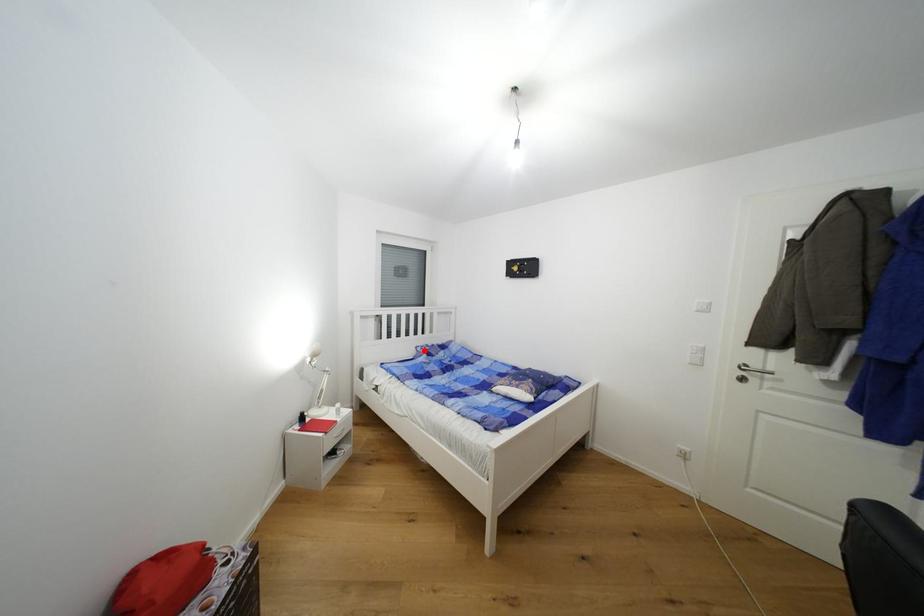
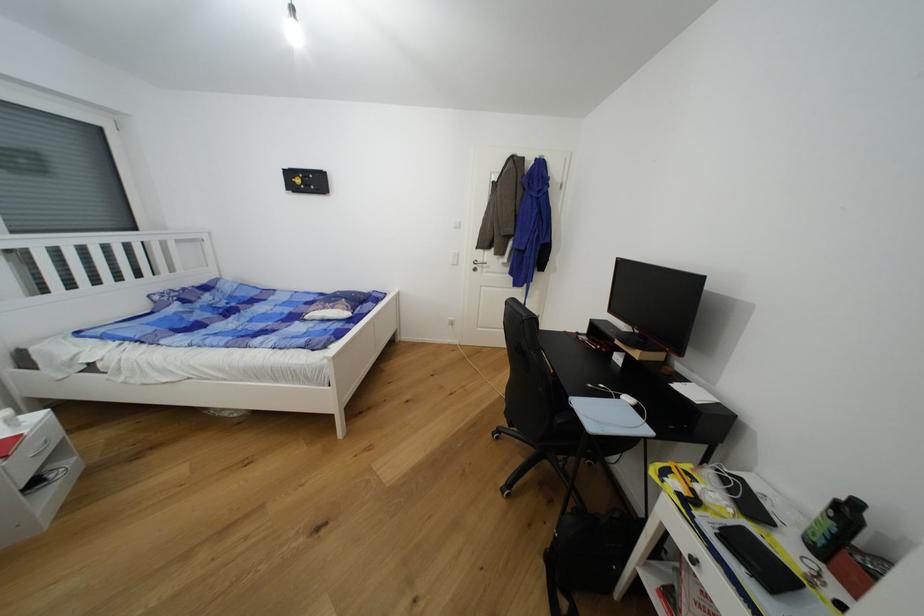
The point at the highlighted location is marked in the first image. Where is the corresponding point in the second image?

(162, 299)